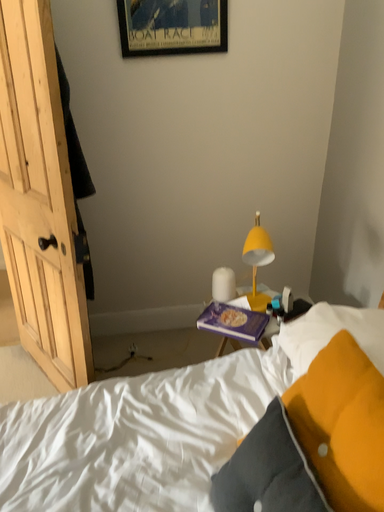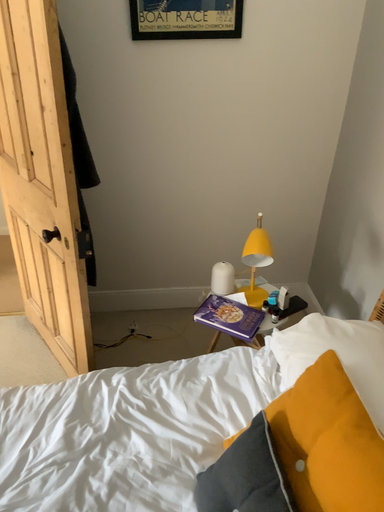
Question: Which way did the camera rotate in the video?

Choices:
 (A) rotated upward
 (B) rotated downward

Answer: (B)